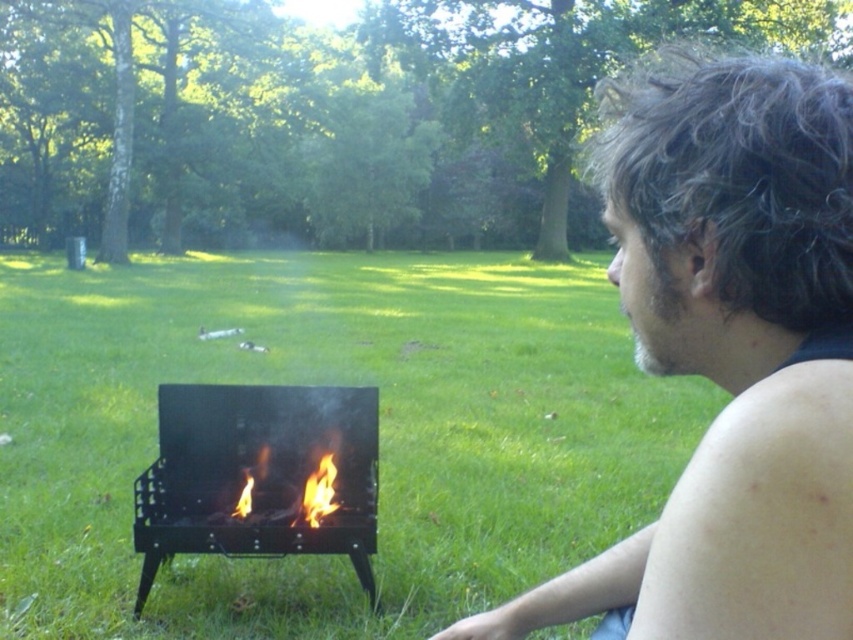
You are planning to set up a picnic blanket in the green grass at center near the black matte barbecue grill at lower left. Considering their widths, which area is wider?

The green grass at center is wider than the black matte barbecue grill at lower left, so the picnic blanket would fit better in the wider green grass area.

You are standing in the park and see a man sitting on the grass facing away from you. He is looking at a black matte barbecue grill. Can you tell me where the point with coordinates (257, 474) is located?

The point with coordinates (257, 474) is located on the black matte barbecue grill at lower left.